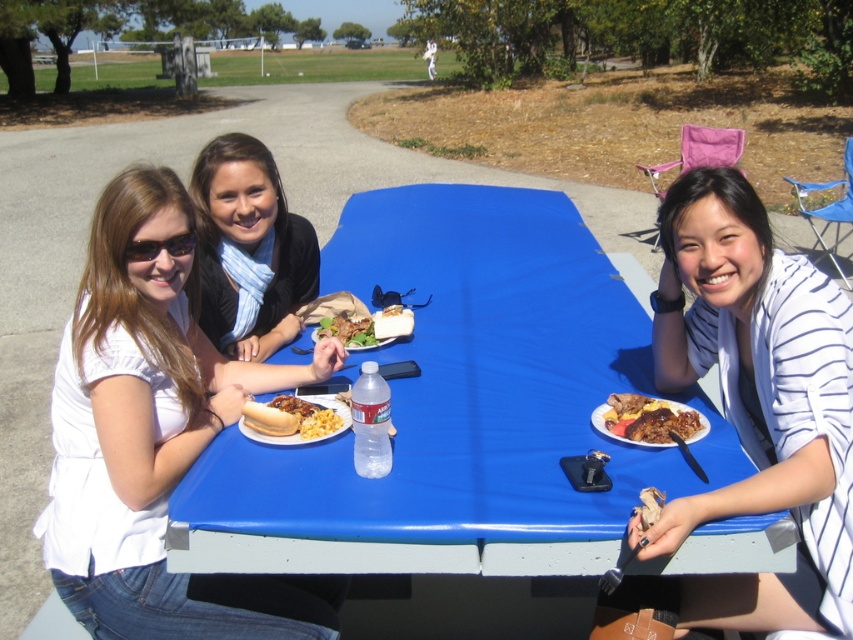
You are taking a photo of the picnic scene and want to focus on both the point at coordinates point (724,413) and point (395,326). Which point should you adjust your focus to first to ensure both are in clear view?

You should focus on point (724,413) first because it is closer to the camera than point (395,326). By focusing on the closer point, the farther point will also be in focus if the depth of field is sufficient.

You are planning to pack a lunch for a hiking trip and want to know which item from the picnic table has a larger portion. Which one is bigger between the brown glossy meat at right and the grilled meat at center?

The brown glossy meat at right is bigger than the grilled meat at center, so it has a larger portion.

You are standing at the picnic table and want to hand a napkin to the person wearing the white striped shirt at upper right. Based on their position, where should you aim to place the napkin so it lands near them?

The white striped shirt at upper right is located at point (x=758, y=401), so you should aim to place the napkin near that coordinate to ensure it reaches the person.